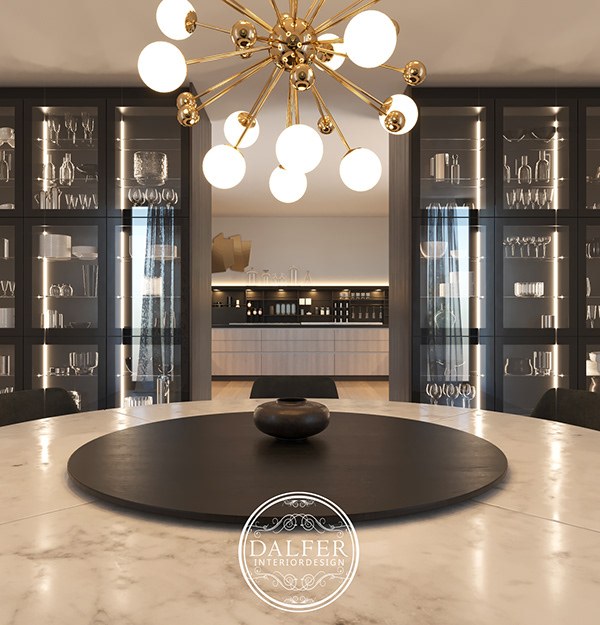
Where is `lights`? lights is located at coordinates (291, 190), (301, 154).